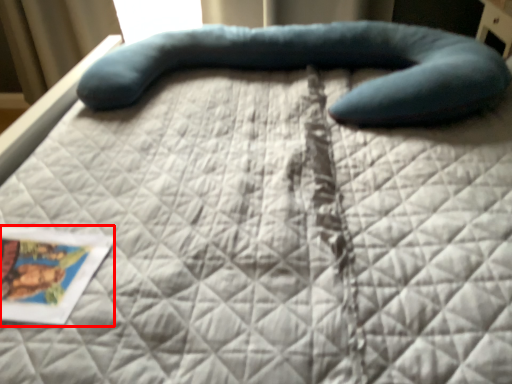
Question: From the image's perspective, what is the correct spatial relationship of postcard (annotated by the red box) in relation to bean bag chair?

Choices:
 (A) above
 (B) below

Answer: (B)